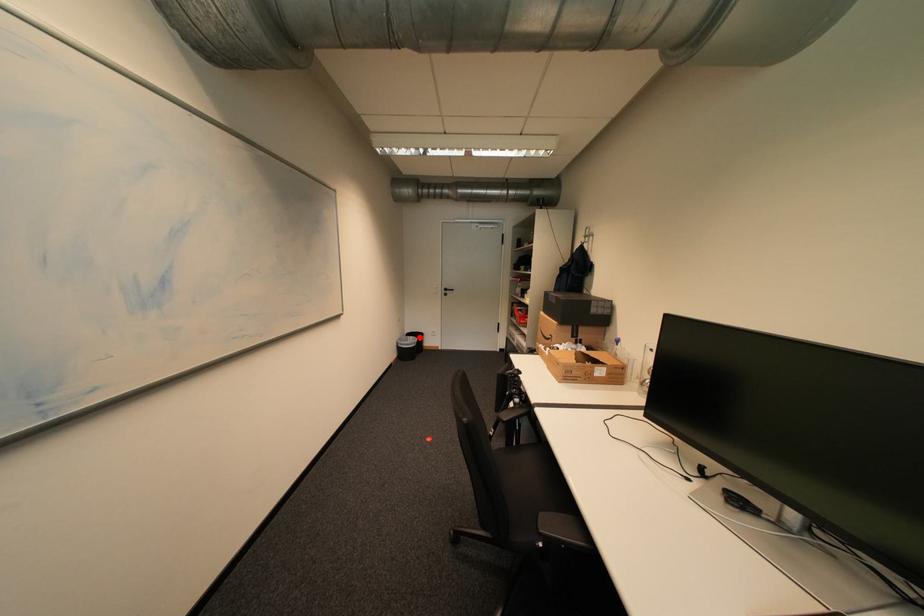
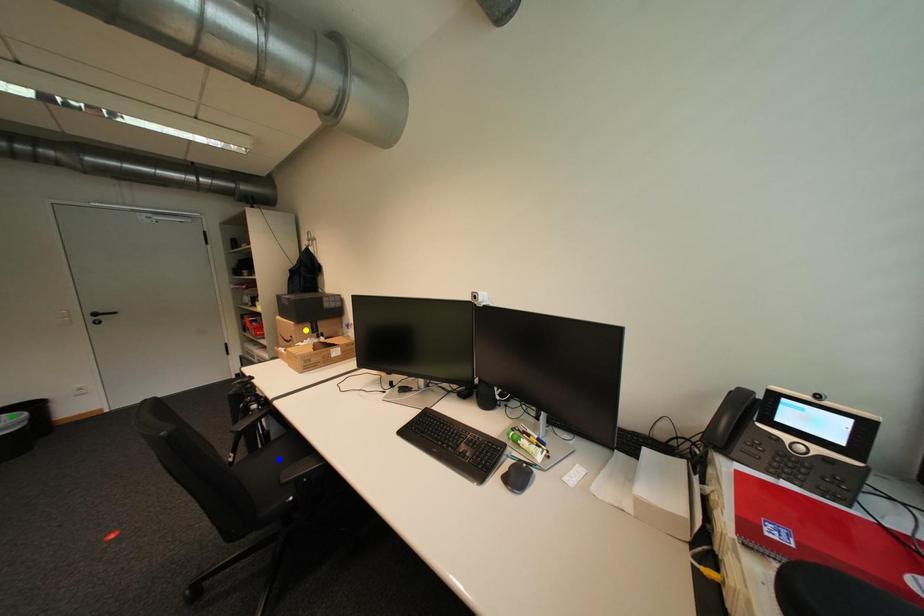
Question: I am providing you with two images of the same scene from different viewpoints. A red point is marked on the first image. You are given multiple points on the second image. Which mark in image 2 goes with the point in image 1?

Choices:
 (A) yellow point
 (B) blue point
 (C) green point

Answer: (C)